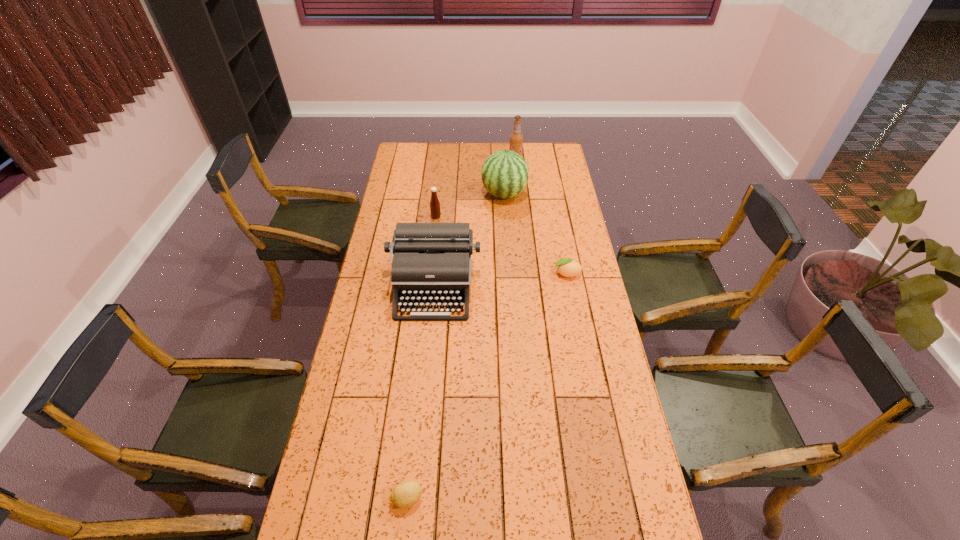
Where is `object positioned at the left edge`? The width and height of the screenshot is (960, 540). object positioned at the left edge is located at coordinates (431, 261).

Locate an element on the screen. The width and height of the screenshot is (960, 540). object situated at the right edge is located at coordinates (567, 267).

Identify the location of vacant space at the far edge of the desktop. (483, 144).

In order to click on free space at the left edge of the desktop in this screenshot , I will do pyautogui.click(x=384, y=256).

Where is `free space at the right edge of the desktop`? The height and width of the screenshot is (540, 960). free space at the right edge of the desktop is located at coordinates (603, 418).

This screenshot has height=540, width=960. In the image, there is a desktop. In order to click on free region at the far right corner in this screenshot , I will do `click(553, 160)`.

Locate an element on the screen. This screenshot has height=540, width=960. free area in between the shortest object and the watermelon is located at coordinates (456, 346).

Find the location of a particular element. free space between the fourth tallest object and the beer bottle is located at coordinates (475, 188).

The height and width of the screenshot is (540, 960). I want to click on free space between the third farthest object and the watermelon, so click(470, 206).

Locate an element on the screen. The height and width of the screenshot is (540, 960). vacant region between the second farthest object and the fourth tallest object is located at coordinates (470, 206).